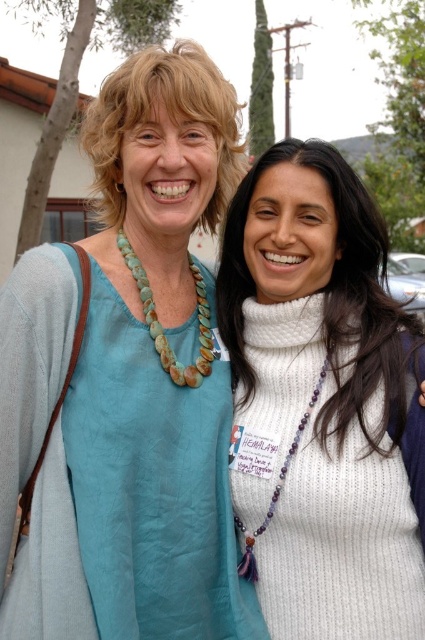
From the picture: You are an artist trying to sketch the scene. You need to place the white knitted sweater at center accurately. According to the coordinates provided, where should you position it on your drawing canvas that is divided into a grid from 0 to 1 in both x and y axes?

The white knitted sweater at center should be positioned at coordinates point 0.625 on the x axis and 0.760 on the y axis.

You are a photographer adjusting your camera settings to focus on the two people in the image. You notice the matte blue blouse at center and the white knitted sweater at center. Which clothing item is positioned higher on the body?

The matte blue blouse at center is above the white knitted sweater at center, so it is positioned higher on the body.